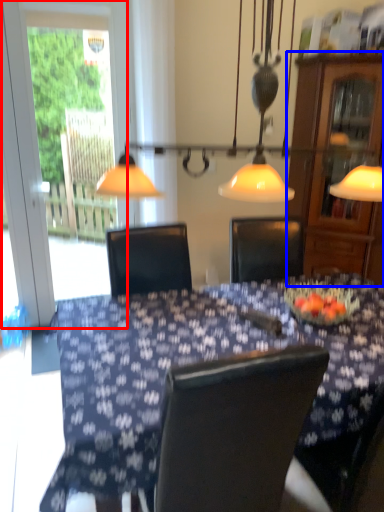
Question: Which of the following is the closest to the observer, screen door (highlighted by a red box) or cabinetry (highlighted by a blue box)?

Choices:
 (A) screen door
 (B) cabinetry

Answer: (B)